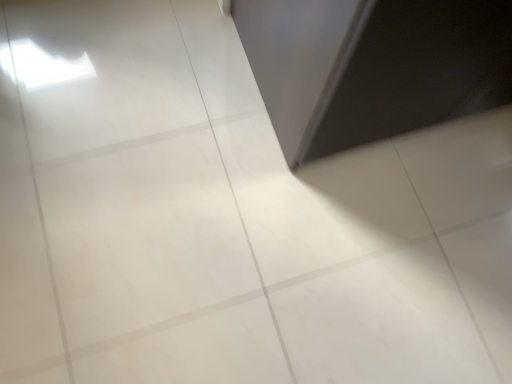
The image size is (512, 384). Find the location of `free spot in front of matte gray door at upper right`. free spot in front of matte gray door at upper right is located at coordinates (340, 250).